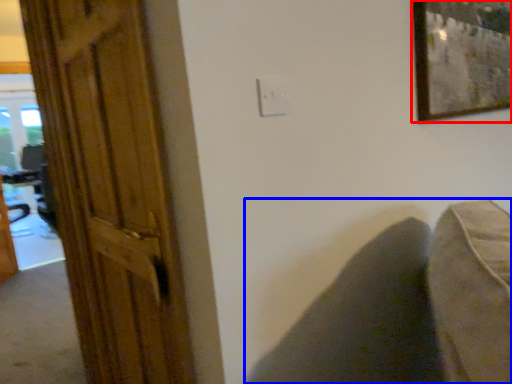
Question: Which point is further to the camera, picture frame (highlighted by a red box) or swivel chair (highlighted by a blue box)?

Choices:
 (A) picture frame
 (B) swivel chair

Answer: (B)